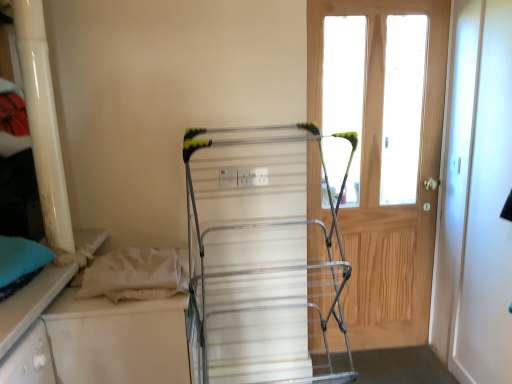
Describe the element at coordinates (379, 179) in the screenshot. The image size is (512, 384). I see `light brown wooden door at right` at that location.

At what (x,y) coordinates should I click in order to perform the action: click on light brown wooden door at right. Please return your answer as a coordinate pair (x, y). The width and height of the screenshot is (512, 384). Looking at the image, I should click on (379, 179).

Measure the distance between silver metallic drying rack at center and camera.

silver metallic drying rack at center is 1.61 meters away from camera.

The image size is (512, 384). Describe the element at coordinates (261, 260) in the screenshot. I see `silver metallic drying rack at center` at that location.

Where is `silver metallic drying rack at center`? Image resolution: width=512 pixels, height=384 pixels. silver metallic drying rack at center is located at coordinates (261, 260).

The width and height of the screenshot is (512, 384). In order to click on light brown wooden door at right in this screenshot , I will do `click(379, 179)`.

Would you say silver metallic drying rack at center is to the left or to the right of light brown wooden door at right in the picture?

silver metallic drying rack at center is to the left of light brown wooden door at right.

Which object is closer to the camera taking this photo, silver metallic drying rack at center or light brown wooden door at right?

silver metallic drying rack at center.

Which is in front, point (215, 204) or point (392, 209)?

The point (215, 204) is more forward.

From the image's perspective, is silver metallic drying rack at center below light brown wooden door at right?

Yes, from the image's perspective, silver metallic drying rack at center is beneath light brown wooden door at right.

From a real-world perspective, does silver metallic drying rack at center stand above light brown wooden door at right?

No.

Between silver metallic drying rack at center and light brown wooden door at right, which one has smaller width?

light brown wooden door at right.

In the scene shown: Considering the sizes of objects silver metallic drying rack at center and light brown wooden door at right in the image provided, who is shorter, silver metallic drying rack at center or light brown wooden door at right?

silver metallic drying rack at center is shorter.

Based on the photo, is silver metallic drying rack at center bigger than light brown wooden door at right?

Correct, silver metallic drying rack at center is larger in size than light brown wooden door at right.

Would you say silver metallic drying rack at center is inside or outside light brown wooden door at right?

silver metallic drying rack at center is located beyond the bounds of light brown wooden door at right.

Is there a large distance between silver metallic drying rack at center and light brown wooden door at right?

silver metallic drying rack at center is near light brown wooden door at right, not far away.

Is silver metallic drying rack at center aimed at light brown wooden door at right?

No.

What's the angular difference between silver metallic drying rack at center and light brown wooden door at right's facing directions?

They differ by 0.757 degrees in their facing directions.

How much distance is there between silver metallic drying rack at center and light brown wooden door at right?

A distance of 15.23 inches exists between silver metallic drying rack at center and light brown wooden door at right.

Find the location of a particular element. door lying above the silver metallic drying rack at center (from the image's perspective) is located at coordinates (379, 179).

Is light brown wooden door at right to the right of silver metallic drying rack at center from the viewer's perspective?

Yes, light brown wooden door at right is to the right of silver metallic drying rack at center.

Is light brown wooden door at right closer to the viewer compared to silver metallic drying rack at center?

No, light brown wooden door at right is further to the viewer.

Is point (403, 211) behind point (329, 296)?

That is True.

From the image's perspective, is light brown wooden door at right positioned above or below silver metallic drying rack at center?

light brown wooden door at right is situated higher than silver metallic drying rack at center in the image.

From a real-world perspective, relative to silver metallic drying rack at center, is light brown wooden door at right vertically above or below?

light brown wooden door at right is above silver metallic drying rack at center.

Considering the sizes of light brown wooden door at right and silver metallic drying rack at center in the image, is light brown wooden door at right wider or thinner than silver metallic drying rack at center?

Clearly, light brown wooden door at right has less width compared to silver metallic drying rack at center.

Considering the relative sizes of light brown wooden door at right and silver metallic drying rack at center in the image provided, is light brown wooden door at right shorter than silver metallic drying rack at center?

No.

Is light brown wooden door at right smaller than silver metallic drying rack at center?

Indeed, light brown wooden door at right has a smaller size compared to silver metallic drying rack at center.

Does light brown wooden door at right contain silver metallic drying rack at center?

Definitely not — silver metallic drying rack at center is not inside light brown wooden door at right.

Is light brown wooden door at right next to silver metallic drying rack at center?

No, light brown wooden door at right is not next to silver metallic drying rack at center.

Is light brown wooden door at right looking in the opposite direction of silver metallic drying rack at center?

No, light brown wooden door at right is not facing the opposite direction of silver metallic drying rack at center.

What's the angular difference between light brown wooden door at right and silver metallic drying rack at center's facing directions?

The angular difference between light brown wooden door at right and silver metallic drying rack at center is 0.757 degrees.

How far apart are light brown wooden door at right and silver metallic drying rack at center?

The distance of light brown wooden door at right from silver metallic drying rack at center is 15.23 inches.

Find the location of `door that is behind the silver metallic drying rack at center`. door that is behind the silver metallic drying rack at center is located at coordinates (379, 179).

The width and height of the screenshot is (512, 384). I want to click on door that appears on the right of silver metallic drying rack at center, so click(379, 179).

Where is `door above the silver metallic drying rack at center (from the image's perspective)`? The width and height of the screenshot is (512, 384). door above the silver metallic drying rack at center (from the image's perspective) is located at coordinates (379, 179).